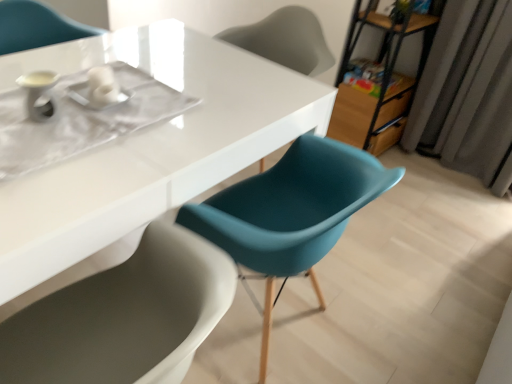
Measure the distance between point (39, 245) and camera.

Point (39, 245) and camera are 32.09 inches apart.

Find the location of `white glossy table at center`. white glossy table at center is located at coordinates (146, 151).

What is the approximate height of metallic brown bookshelf at upper right?

It is 86.94 centimeters.

This screenshot has height=384, width=512. I want to click on gray fabric curtain at right, so click(x=468, y=93).

Is the position of metallic brown bookshelf at upper right more distant than that of matte teal chair at upper center, the 1th chair in the top-to-bottom sequence?

Yes, the depth of metallic brown bookshelf at upper right is greater than that of matte teal chair at upper center, the 1th chair in the top-to-bottom sequence.

Considering the positions of objects metallic brown bookshelf at upper right and matte teal chair at upper center, which appears as the second chair when ordered from the bottom, in the image provided, who is more to the right, metallic brown bookshelf at upper right or matte teal chair at upper center, which appears as the second chair when ordered from the bottom,?

From the viewer's perspective, metallic brown bookshelf at upper right appears more on the right side.

Between metallic brown bookshelf at upper right and matte teal chair at upper center, which is the 2th chair in front-to-back order, which one has smaller width?

metallic brown bookshelf at upper right is thinner.

From the image's perspective, who appears lower, metallic brown bookshelf at upper right or matte teal chair at upper center, positioned as the 1th chair in back-to-front order?

From the image's view, matte teal chair at upper center, positioned as the 1th chair in back-to-front order, is below.

Looking at this image, from the image's perspective, relative to white glossy table at center, is gray fabric curtain at right above or below?

gray fabric curtain at right is above white glossy table at center.

Which object is closer to the camera taking this photo, gray fabric curtain at right or white glossy table at center?

white glossy table at center is more forward.

Is gray fabric curtain at right taller than white glossy table at center?

Indeed, gray fabric curtain at right has a greater height compared to white glossy table at center.

In the scene shown: Would you say matte teal chair at upper center, the 1th chair in the top-to-bottom sequence, is inside or outside gray fabric curtain at right?

matte teal chair at upper center, the 1th chair in the top-to-bottom sequence, exists outside the volume of gray fabric curtain at right.

Considering the relative sizes of matte teal chair at upper center, positioned as the 1th chair in back-to-front order, and gray fabric curtain at right in the image provided, is matte teal chair at upper center, positioned as the 1th chair in back-to-front order, thinner than gray fabric curtain at right?

No.

Does matte teal chair at upper center, the 1th chair in the top-to-bottom sequence, appear on the right side of gray fabric curtain at right?

Incorrect, matte teal chair at upper center, the 1th chair in the top-to-bottom sequence, is not on the right side of gray fabric curtain at right.

Based on the photo, which is more to the left, matte teal chair at upper center, the 1th chair in the top-to-bottom sequence, or metallic brown bookshelf at upper right?

From the viewer's perspective, matte teal chair at upper center, the 1th chair in the top-to-bottom sequence, appears more on the left side.

Which of these two, matte teal chair at upper center, positioned as the 1th chair in back-to-front order, or metallic brown bookshelf at upper right, is bigger?

metallic brown bookshelf at upper right is bigger.

Would you say metallic brown bookshelf at upper right is part of matte teal chair at upper center, the 1th chair in the top-to-bottom sequence,'s contents?

No, matte teal chair at upper center, the 1th chair in the top-to-bottom sequence, does not contain metallic brown bookshelf at upper right.

Is matte teal chair at upper center, the 1th chair in the top-to-bottom sequence, positioned with its back to metallic brown bookshelf at upper right?

Correct, matte teal chair at upper center, the 1th chair in the top-to-bottom sequence, is looking away from metallic brown bookshelf at upper right.

From the picture: Which is more distant, [358,133] or [444,150]?

The point [444,150] is more distant.

Looking at this image, is metallic brown bookshelf at upper right not near gray fabric curtain at right?

No.

How different are the orientations of metallic brown bookshelf at upper right and gray fabric curtain at right in degrees?

There is a 88.7-degree angle between the facing directions of metallic brown bookshelf at upper right and gray fabric curtain at right.

Considering the positions of objects metallic brown bookshelf at upper right and gray fabric curtain at right in the image provided, who is behind, metallic brown bookshelf at upper right or gray fabric curtain at right?

metallic brown bookshelf at upper right.

Considering the points (310, 58) and (364, 153), which point is in front, point (310, 58) or point (364, 153)?

The point (310, 58) is closer.

Which is more to the left, matte teal chair at upper center, which appears as the second chair when ordered from the bottom, or matte teal chair at center, which is the second chair from top to bottom?

Positioned to the left is matte teal chair at center, which is the second chair from top to bottom.

The image size is (512, 384). I want to click on chair in front of the matte teal chair at upper center, the 1th chair in the top-to-bottom sequence, so click(x=290, y=211).

Does matte teal chair at upper center, which appears as the second chair when ordered from the bottom, turn towards matte teal chair at center, which appears as the first chair when ordered from the bottom?

No, matte teal chair at upper center, which appears as the second chair when ordered from the bottom, is not oriented towards matte teal chair at center, which appears as the first chair when ordered from the bottom.

From a real-world perspective, between gray fabric curtain at right and matte teal chair at upper center, the 1th chair in the top-to-bottom sequence, who is vertically higher?

In real-world perspective, matte teal chair at upper center, the 1th chair in the top-to-bottom sequence, is above.

There is a gray fabric curtain at right. Where is `chair above it (from a real-world perspective)`? Image resolution: width=512 pixels, height=384 pixels. chair above it (from a real-world perspective) is located at coordinates (285, 40).

From the image's perspective, is gray fabric curtain at right below matte teal chair at upper center, the 1th chair in the top-to-bottom sequence?

Yes, from the image's perspective, gray fabric curtain at right is beneath matte teal chair at upper center, the 1th chair in the top-to-bottom sequence.

Which is more to the right, gray fabric curtain at right or matte teal chair at upper center, positioned as the 1th chair in back-to-front order?

gray fabric curtain at right.

Identify the location of bookshelf below the matte teal chair at upper center, which appears as the second chair when ordered from the bottom (from a real-world perspective). (384, 80).

Locate an element on the screen. The image size is (512, 384). table below the gray fabric curtain at right (from the image's perspective) is located at coordinates (146, 151).

Estimate the real-world distances between objects in this image. Which object is further from gray fabric curtain at right, metallic brown bookshelf at upper right or matte teal chair at upper center, which appears as the second chair when ordered from the bottom?

matte teal chair at upper center, which appears as the second chair when ordered from the bottom, is further to gray fabric curtain at right.

Based on their spatial positions, is metallic brown bookshelf at upper right or matte teal chair at center, which is counted as the 2th chair, starting from the back, further from gray fabric curtain at right?

Based on the image, matte teal chair at center, which is counted as the 2th chair, starting from the back, appears to be further to gray fabric curtain at right.

Estimate the real-world distances between objects in this image. Which object is further from matte teal chair at upper center, which is the 2th chair in front-to-back order, matte teal chair at center, which is the second chair from top to bottom, or gray fabric curtain at right?

matte teal chair at center, which is the second chair from top to bottom, is further to matte teal chair at upper center, which is the 2th chair in front-to-back order.

Considering their positions, is white glossy table at center positioned closer to matte teal chair at center, which is counted as the 2th chair, starting from the back, than matte teal chair at upper center, the 1th chair in the top-to-bottom sequence?

Based on the image, white glossy table at center appears to be nearer to matte teal chair at center, which is counted as the 2th chair, starting from the back.

When comparing their distances from matte teal chair at upper center, the 1th chair in the top-to-bottom sequence, does white glossy table at center or gray fabric curtain at right seem further?

gray fabric curtain at right.

Based on their spatial positions, is gray fabric curtain at right or metallic brown bookshelf at upper right further from matte teal chair at upper center, positioned as the 1th chair in back-to-front order?

gray fabric curtain at right.

Looking at the image, which one is located closer to gray fabric curtain at right, matte teal chair at center, which appears as the first chair when ordered from the bottom, or metallic brown bookshelf at upper right?

The object closer to gray fabric curtain at right is metallic brown bookshelf at upper right.

Which object lies further to the anchor point matte teal chair at upper center, which is the 2th chair in front-to-back order, gray fabric curtain at right or matte teal chair at center, which is the second chair from top to bottom?

matte teal chair at center, which is the second chair from top to bottom, is positioned further to the anchor matte teal chair at upper center, which is the 2th chair in front-to-back order.

Where is `bookshelf between white glossy table at center and gray fabric curtain at right from left to right`? bookshelf between white glossy table at center and gray fabric curtain at right from left to right is located at coordinates (384, 80).

The image size is (512, 384). Identify the location of curtain between matte teal chair at center, which is the second chair from top to bottom, and metallic brown bookshelf at upper right in the front-back direction. (468, 93).

You are a GUI agent. You are given a task and a screenshot of the screen. Output one action in this format:
    pyautogui.click(x=<x>, y=<y>)
    Task: Click on the bookshelf between matte teal chair at upper center, the 1th chair in the top-to-bottom sequence, and gray fabric curtain at right
    The width and height of the screenshot is (512, 384).
    Given the screenshot: What is the action you would take?
    pyautogui.click(x=384, y=80)

The image size is (512, 384). Identify the location of chair between matte teal chair at center, which is counted as the 2th chair, starting from the back, and metallic brown bookshelf at upper right from front to back. (285, 40).